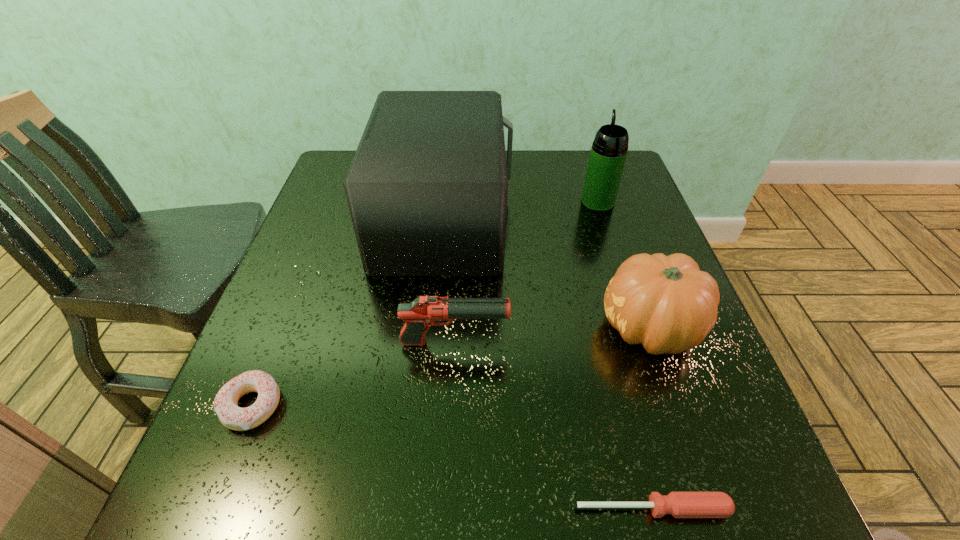
In order to click on vacant region located from the spout of the thermos bottle in this screenshot , I will do `click(588, 172)`.

I want to click on vacant point located from the spout of the thermos bottle, so 582,152.

Identify the location of free space located 0.320m on the carved face of the pumpkin. (437, 328).

Identify the location of free point located on the carved face of the pumpkin. coord(528,328).

At what (x,y) coordinates should I click in order to perform the action: click on free space located on the carved face of the pumpkin. Please return your answer as a coordinate pair (x, y). The width and height of the screenshot is (960, 540). Looking at the image, I should click on (543, 328).

Find the location of `vacant space located at the aiming end of the fourth tallest object`. vacant space located at the aiming end of the fourth tallest object is located at coordinates (581, 343).

Identify the location of vacant region located on the right of the doughnut. (346, 406).

I want to click on vacant space located 0.350m on the left of the nearest object, so click(334, 509).

This screenshot has width=960, height=540. What are the coordinates of `microwave oven that is at the far edge` in the screenshot? It's located at (427, 189).

At what (x,y) coordinates should I click in order to perform the action: click on thermos bottle present at the far edge. Please return your answer as a coordinate pair (x, y). This screenshot has height=540, width=960. Looking at the image, I should click on pos(608,154).